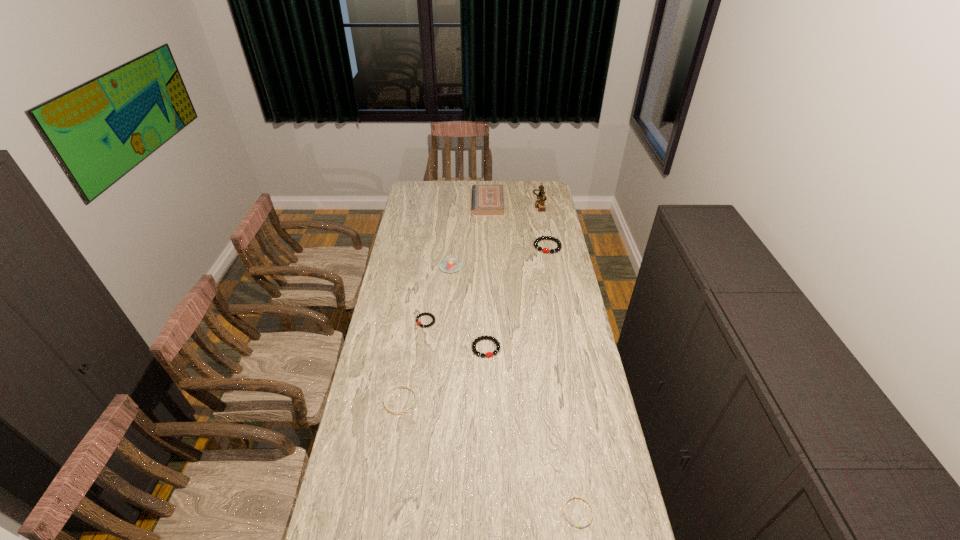
Where is `free space between the second smallest black bracelet and the fourth farthest bracelet`? The width and height of the screenshot is (960, 540). free space between the second smallest black bracelet and the fourth farthest bracelet is located at coordinates (444, 374).

Locate an element on the screen. Image resolution: width=960 pixels, height=540 pixels. free space between the Bible and the brown telephone is located at coordinates (514, 202).

What are the coordinates of `free spot between the telephone and the shortest object` in the screenshot? It's located at (559, 357).

Identify the location of unoccupied position between the nearer blue bracelet and the brown telephone. (559, 357).

Locate an element on the screen. The height and width of the screenshot is (540, 960). vacant area between the telephone and the third nearest bracelet is located at coordinates (513, 275).

Locate an element on the screen. Image resolution: width=960 pixels, height=540 pixels. the third closest object to the third bracelet from left to right is located at coordinates (449, 265).

I want to click on object that ranks as the sixth closest to the second smallest black bracelet, so click(487, 199).

Where is `bracelet that can be found as the fourth closest to the brown telephone`? Image resolution: width=960 pixels, height=540 pixels. bracelet that can be found as the fourth closest to the brown telephone is located at coordinates (390, 390).

This screenshot has width=960, height=540. What are the coordinates of `bracelet object that ranks as the fourth closest to the telephone` in the screenshot? It's located at (390, 390).

Image resolution: width=960 pixels, height=540 pixels. I want to click on black bracelet that stands as the closest to the farthest black bracelet, so click(489, 354).